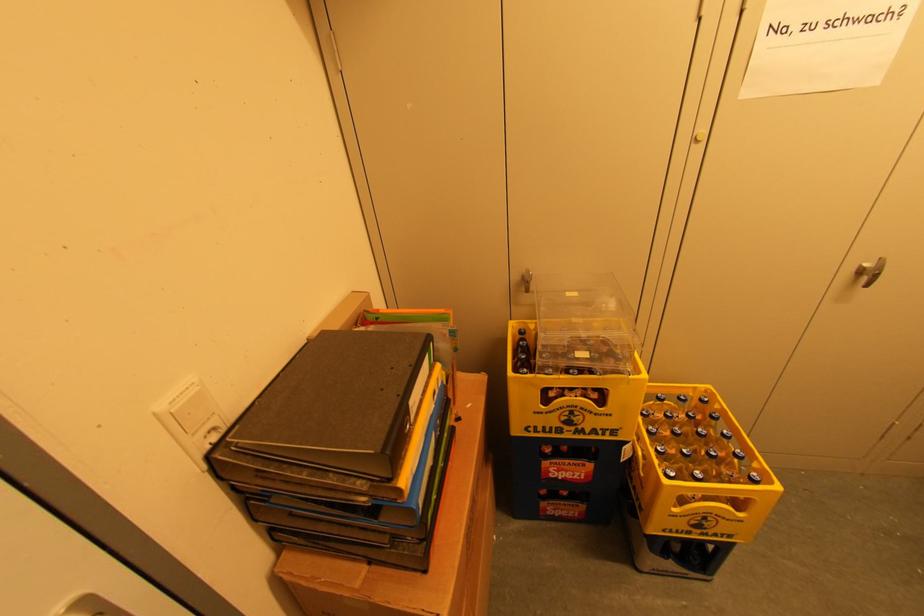
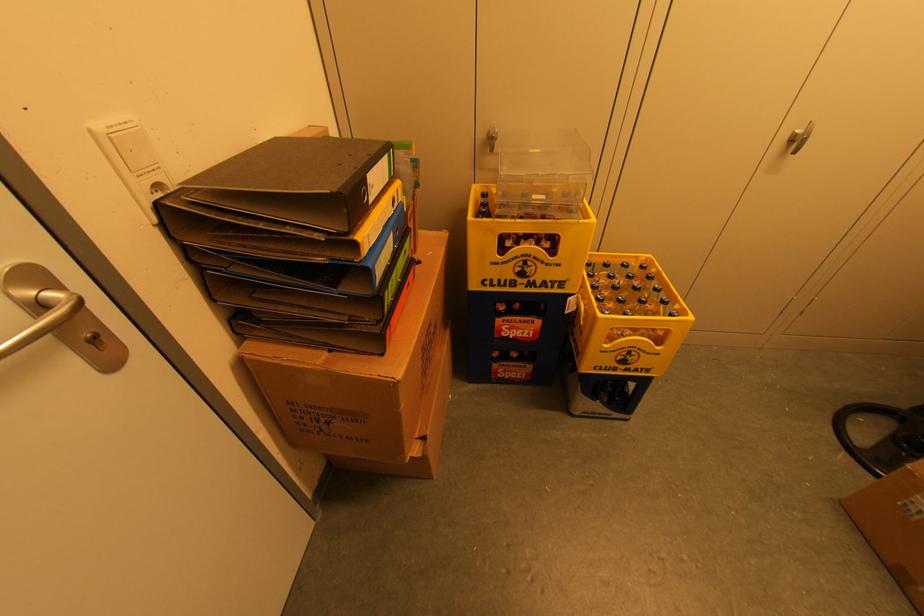
Question: I am providing you with two images of the same scene from different viewpoints. Please identify which objects are invisible in image2.

Choices:
 (A) white light switch
 (B) yellow bottle crate
 (C) clear plastic box
 (D) none of these

Answer: (D)